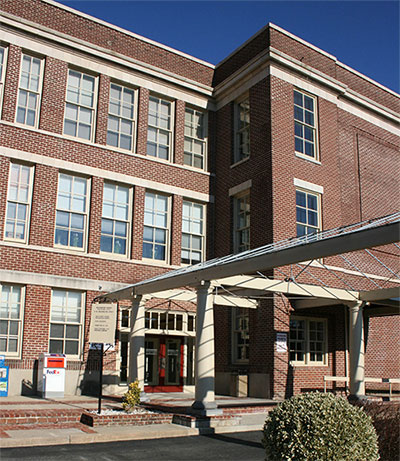
Locate an element on the screen. The image size is (400, 461). windows is located at coordinates (122, 113).